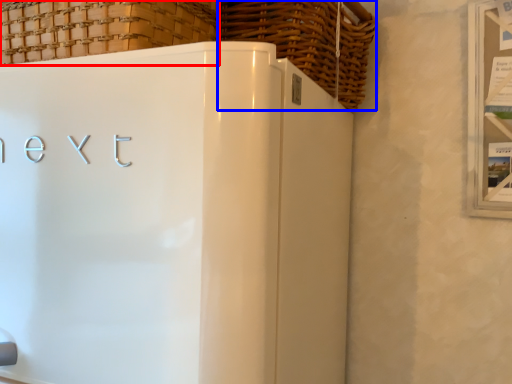
Question: Which point is closer to the camera, basket (highlighted by a red box) or basket (highlighted by a blue box)?

Choices:
 (A) basket
 (B) basket

Answer: (A)